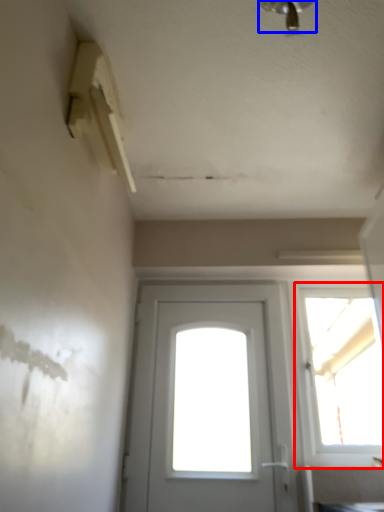
Question: Which point is closer to the camera, window (highlighted by a red box) or light fixture (highlighted by a blue box)?

Choices:
 (A) window
 (B) light fixture

Answer: (B)